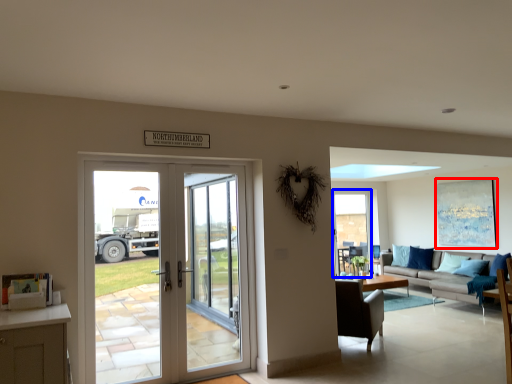
Question: Which of the following is the farthest to the observer, picture frame (highlighted by a red box) or window screen (highlighted by a blue box)?

Choices:
 (A) picture frame
 (B) window screen

Answer: (B)